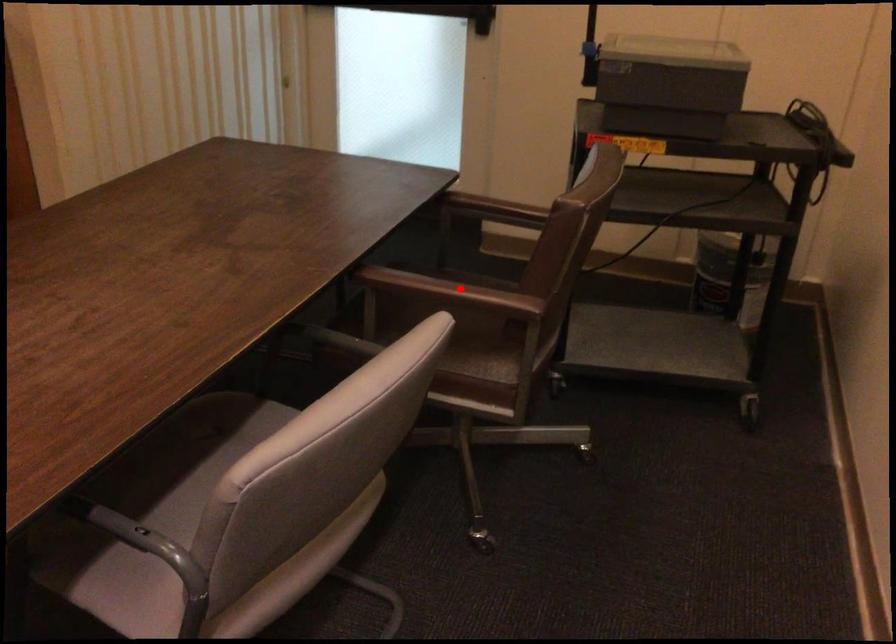
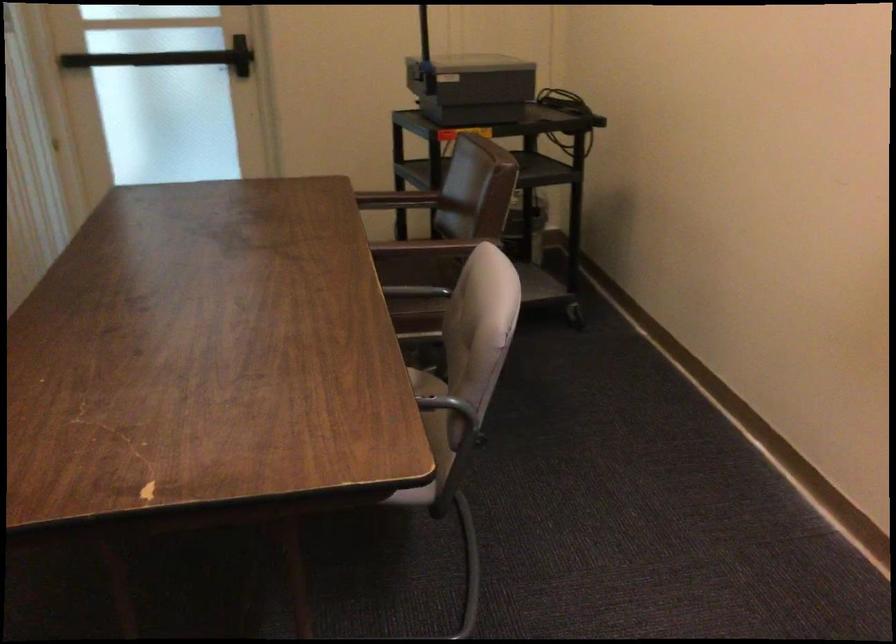
Question: I am providing you with two images of the same scene from different viewpoints. A red point is marked on the first image. Is the red point's position out of view in image 2?

Choices:
 (A) Yes
 (B) No

Answer: (A)